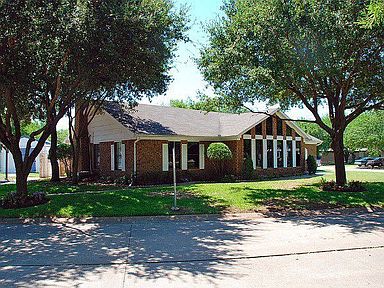
You are a GUI agent. You are given a task and a screenshot of the screen. Output one action in this format:
    pyautogui.click(x=<x>, y=<y>)
    Task: Click on the window
    The height and width of the screenshot is (288, 384).
    Given the screenshot: What is the action you would take?
    pyautogui.click(x=271, y=161)